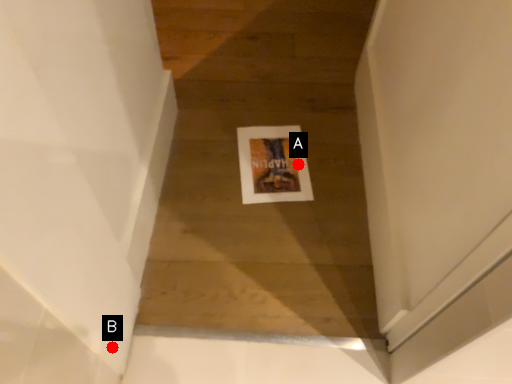
Question: Two points are circled on the image, labeled by A and B beside each circle. Which of the following is the farthest from the observer?

Choices:
 (A) A is further
 (B) B is further

Answer: (A)